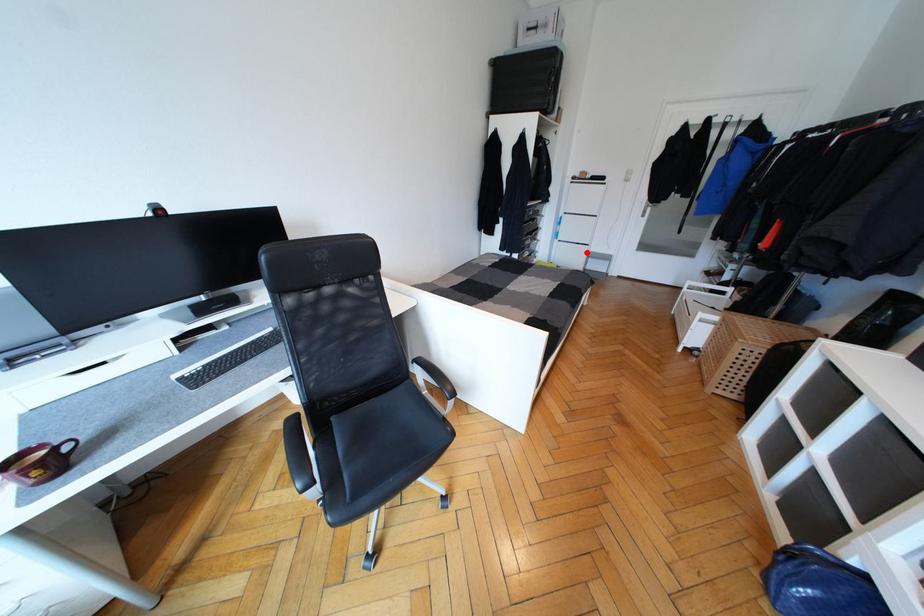
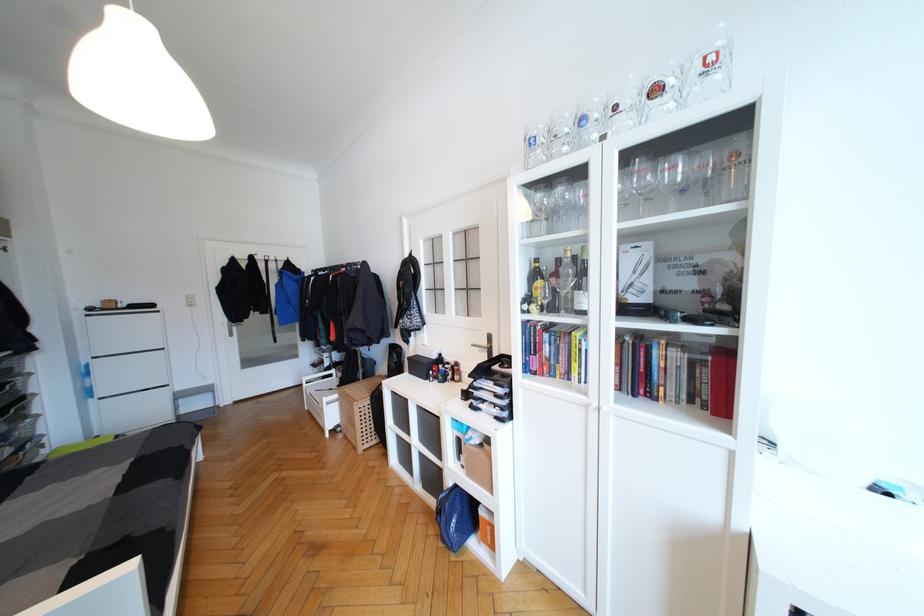
Where in the second image is the point corresponding to the highlighted location from the first image?

(166, 397)